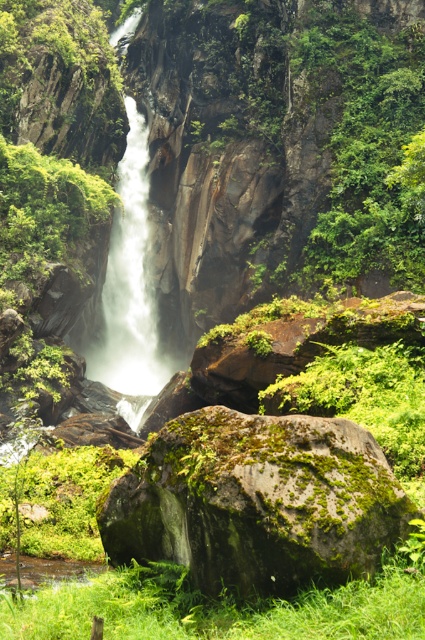
You are a hiker standing at the base of the waterfall. You see the green mossy rock at center and the white frothy water at center. Which object is closer to your current position?

The green mossy rock at center is closer to your current position because it is located below the white frothy water at center, which is higher up.

You are standing at the edge of the waterfall and see the green mossy rock at center and the white frothy water at center. Which object is positioned to the right side from your viewpoint?

The green mossy rock at center is positioned to the right of the white frothy water at center.